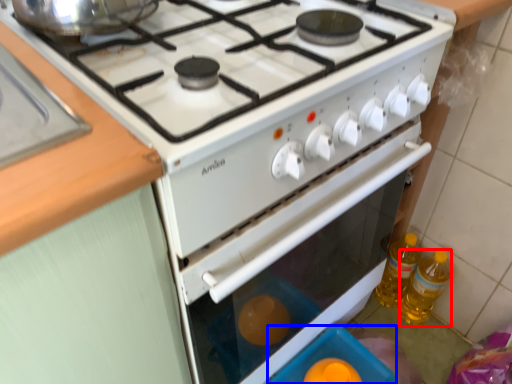
Question: Among these objects, which one is farthest to the camera, bottle (highlighted by a red box) or appliance (highlighted by a blue box)?

Choices:
 (A) bottle
 (B) appliance

Answer: (A)